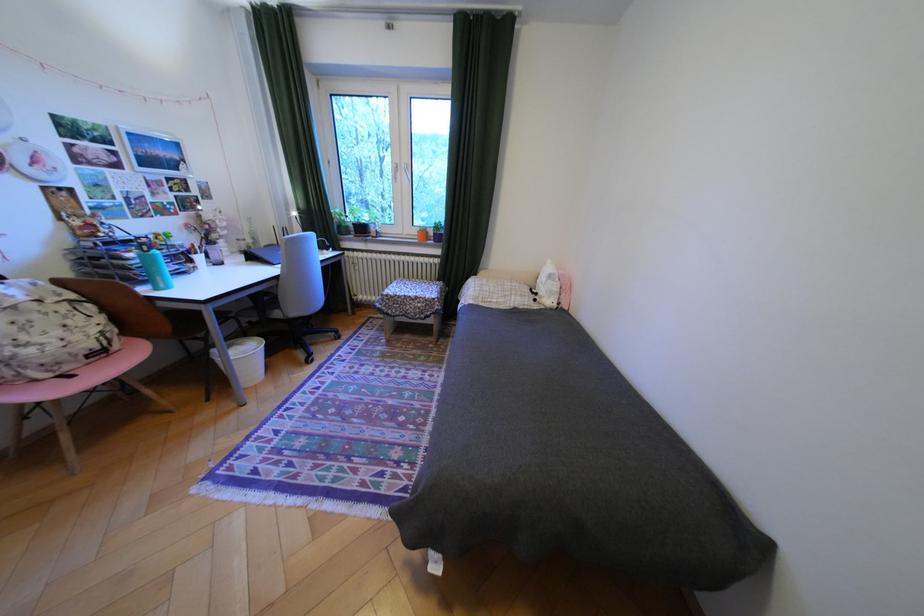
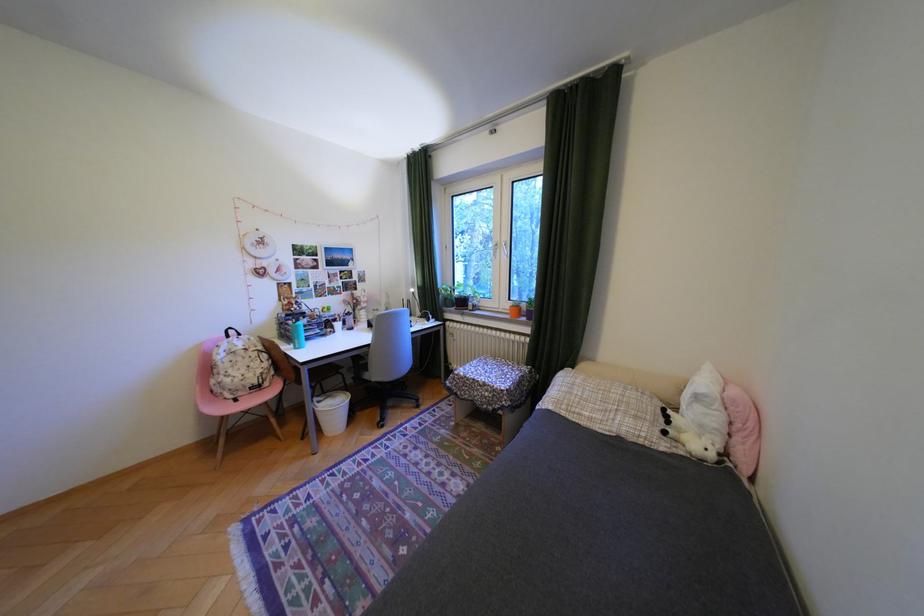
Find the pixel in the second image that matches point 373,230 in the first image.

(475, 302)